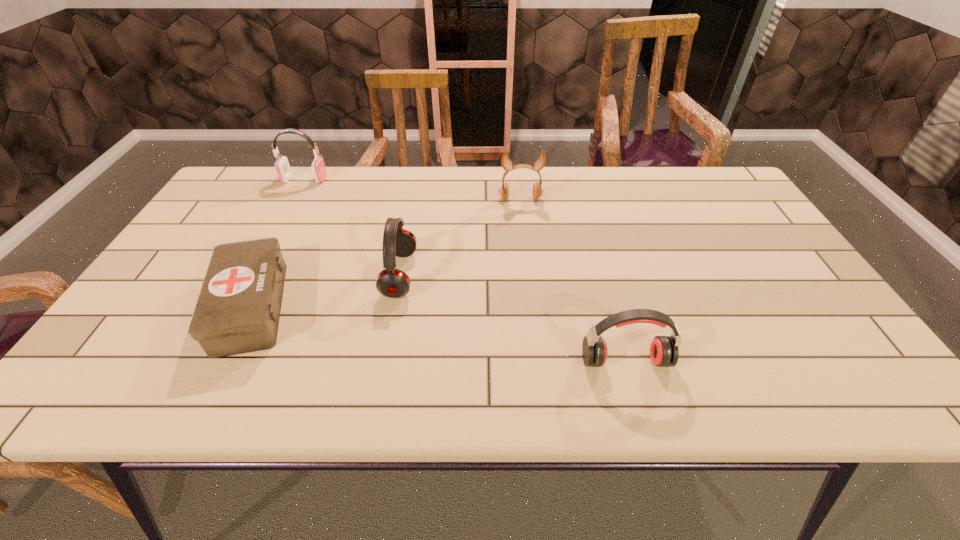
Locate which earphone ranks second in proximity to the first-aid kit. Please provide its 2D coordinates. Your answer should be formatted as a tuple, i.e. [(x, y)], where the tuple contains the x and y coordinates of a point satisfying the conditions above.

[(282, 166)]

The width and height of the screenshot is (960, 540). In order to click on earphone that stands as the fourth closest to the shortest object in this screenshot , I will do `click(664, 352)`.

I want to click on vacant space that satisfies the following two spatial constraints: 1. on the outer surface of the first-aid kit; 2. on the left side of the leftmost earphone, so click(x=236, y=307).